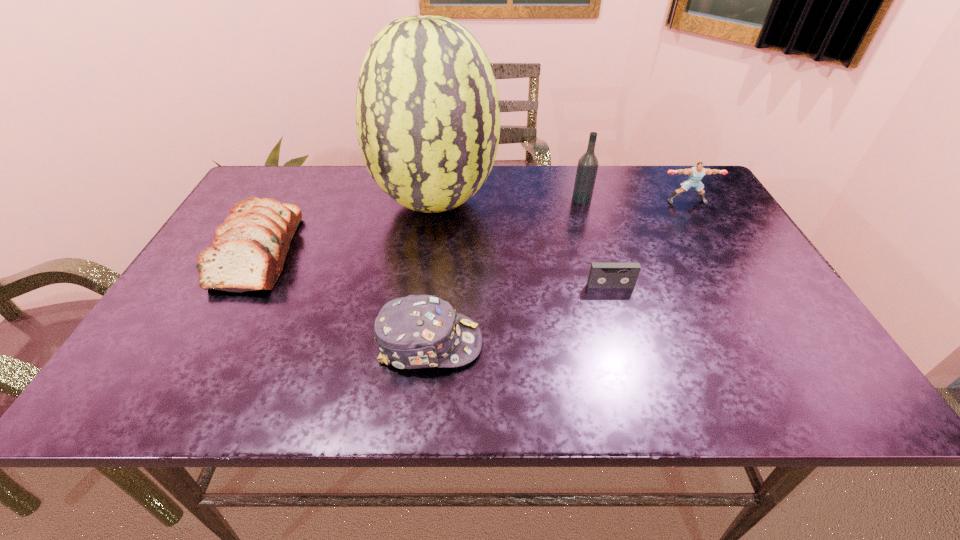
Where is `vacant area between the videotape and the rightmost object`? The width and height of the screenshot is (960, 540). vacant area between the videotape and the rightmost object is located at coordinates (649, 244).

Locate an element on the screen. This screenshot has width=960, height=540. vacant region between the puncher and the nearest object is located at coordinates (558, 272).

The image size is (960, 540). Find the location of `vacant area that lies between the headwear and the leftmost object`. vacant area that lies between the headwear and the leftmost object is located at coordinates (346, 296).

Locate which object is the fourth closest to the rightmost object. Please provide its 2D coordinates. Your answer should be formatted as a tuple, i.e. [(x, y)], where the tuple contains the x and y coordinates of a point satisfying the conditions above.

[(417, 331)]

Locate which object is the closest to the bread. Please provide its 2D coordinates. Your answer should be formatted as a tuple, i.e. [(x, y)], where the tuple contains the x and y coordinates of a point satisfying the conditions above.

[(427, 107)]

Locate an element on the screen. free location that satisfies the following two spatial constraints: 1. on the front-facing side of the rightmost object; 2. on the front-facing side of the nearest object is located at coordinates (770, 343).